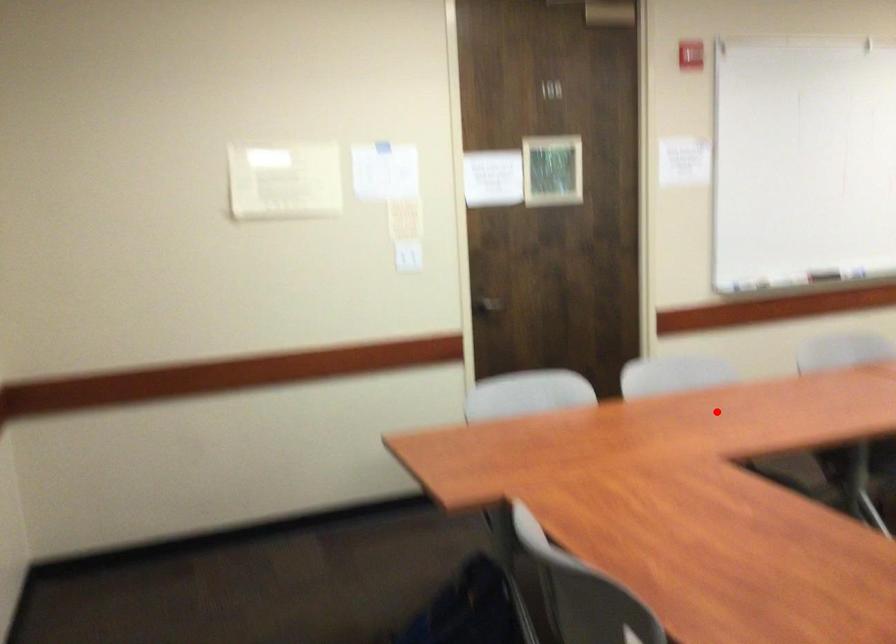
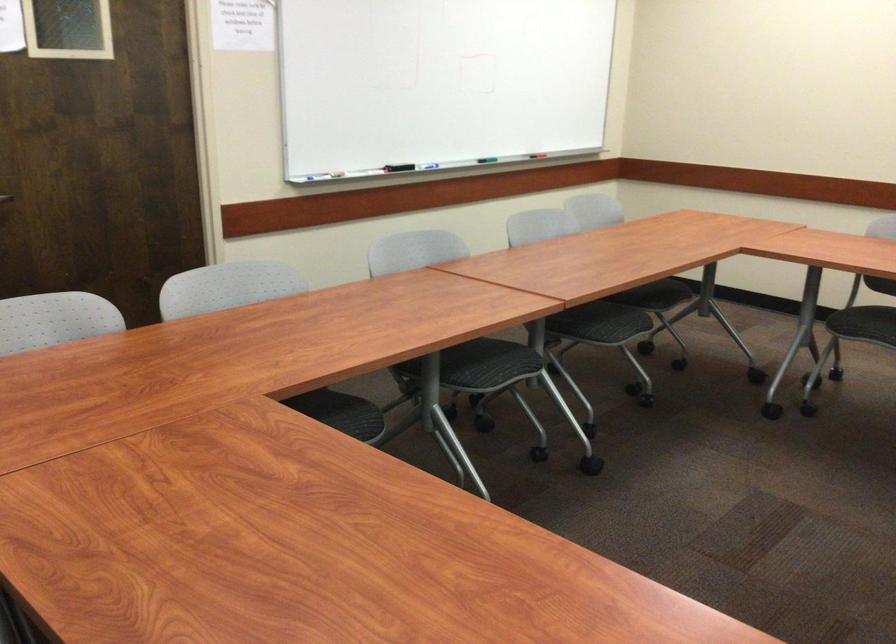
Where in the second image is the point corresponding to the highlighted location from the first image?

(265, 330)